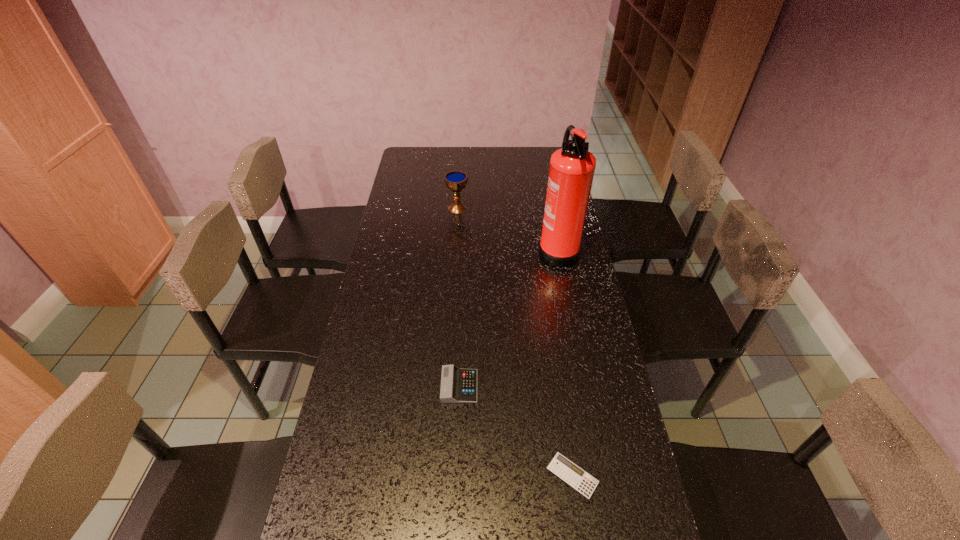
The width and height of the screenshot is (960, 540). I want to click on vacant area situated 0.320m at the nozzle of the third nearest object, so click(x=453, y=248).

Identify the location of vacant point located on the back of the second tallest object. (460, 160).

Find the location of a particular element. free space located on the left of the farther calculator is located at coordinates [x=356, y=386].

Locate an element on the screen. The image size is (960, 540). free space located 0.060m on the front of the right calculator is located at coordinates (581, 528).

The width and height of the screenshot is (960, 540). Find the location of `fire extinguisher positioned at the right edge`. fire extinguisher positioned at the right edge is located at coordinates (572, 167).

The width and height of the screenshot is (960, 540). What are the coordinates of `calculator that is at the right edge` in the screenshot? It's located at (561, 466).

The image size is (960, 540). What are the coordinates of `free space at the far edge of the desktop` in the screenshot? It's located at (525, 171).

Image resolution: width=960 pixels, height=540 pixels. In order to click on vacant region at the left edge of the desktop in this screenshot , I will do `click(339, 493)`.

This screenshot has width=960, height=540. Find the location of `free region at the right edge`. free region at the right edge is located at coordinates (581, 246).

Locate an element on the screen. This screenshot has width=960, height=540. vacant region at the far right corner of the desktop is located at coordinates (539, 150).